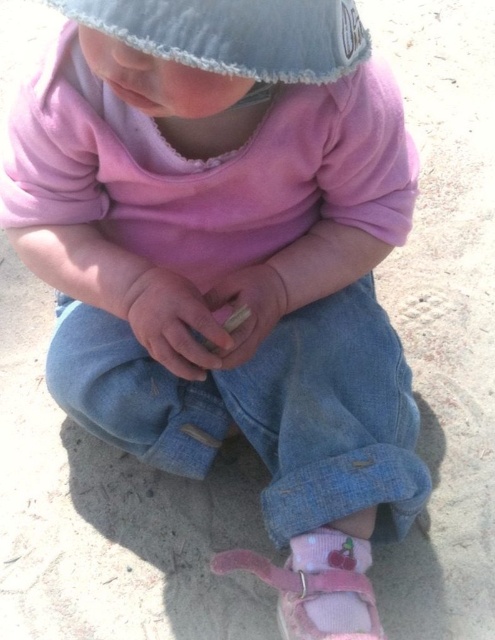
Does denim knit hat at upper center appear over wooden stick at center?

Correct, denim knit hat at upper center is located above wooden stick at center.

Does point (129, 35) lie in front of point (237, 353)?

Yes, it is in front of point (237, 353).

The width and height of the screenshot is (495, 640). Describe the element at coordinates (237, 35) in the screenshot. I see `denim knit hat at upper center` at that location.

Where is `denim knit hat at upper center`? denim knit hat at upper center is located at coordinates (237, 35).

Who is taller, denim knit hat at upper center or smooth beige stick at center?

With more height is smooth beige stick at center.

Looking at this image, how distant is denim knit hat at upper center from smooth beige stick at center?

A distance of 14.59 inches exists between denim knit hat at upper center and smooth beige stick at center.

Which is behind, point (327, 8) or point (221, 349)?

Point (221, 349)

Where is `denim knit hat at upper center`? The width and height of the screenshot is (495, 640). denim knit hat at upper center is located at coordinates (237, 35).

Is denim knit hat at upper center positioned behind pink suede shoe at lower center?

No, denim knit hat at upper center is in front of pink suede shoe at lower center.

Between denim knit hat at upper center and pink suede shoe at lower center, which one has more height?

Standing taller between the two is pink suede shoe at lower center.

Between point (283, 29) and point (295, 576), which one is positioned in front?

Point (283, 29)

At what (x,y) coordinates should I click in order to perform the action: click on denim knit hat at upper center. Please return your answer as a coordinate pair (x, y). The width and height of the screenshot is (495, 640). Looking at the image, I should click on (237, 35).